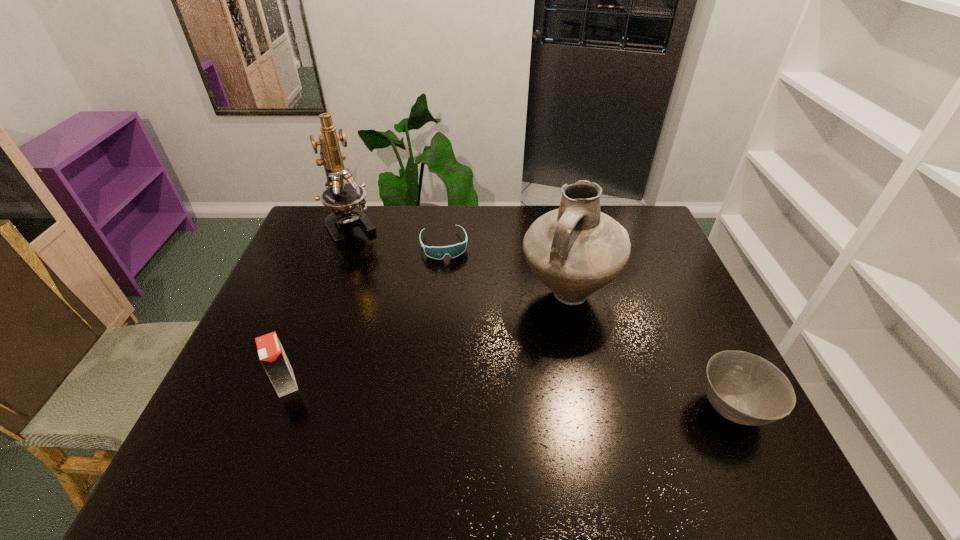
Where is `orange juice`? Image resolution: width=960 pixels, height=540 pixels. orange juice is located at coordinates (272, 356).

Where is `bowl`? This screenshot has width=960, height=540. bowl is located at coordinates (744, 388).

Find the location of `the rightmost object`. the rightmost object is located at coordinates (744, 388).

The image size is (960, 540). I want to click on pitcher, so click(575, 250).

Find the location of a particular element. The width and height of the screenshot is (960, 540). the third nearest object is located at coordinates (575, 250).

Where is `the shortest object`? The width and height of the screenshot is (960, 540). the shortest object is located at coordinates (453, 251).

I want to click on the third object from right to left, so click(x=453, y=251).

Locate an element on the screen. The width and height of the screenshot is (960, 540). microscope is located at coordinates (342, 198).

Locate an element on the screen. This screenshot has width=960, height=540. vacant region located 0.140m on the back of the third tallest object is located at coordinates (307, 327).

At what (x,y) coordinates should I click in order to perform the action: click on vacant space situated on the back of the rightmost object. Please return your answer as a coordinate pair (x, y). Looking at the image, I should click on (689, 318).